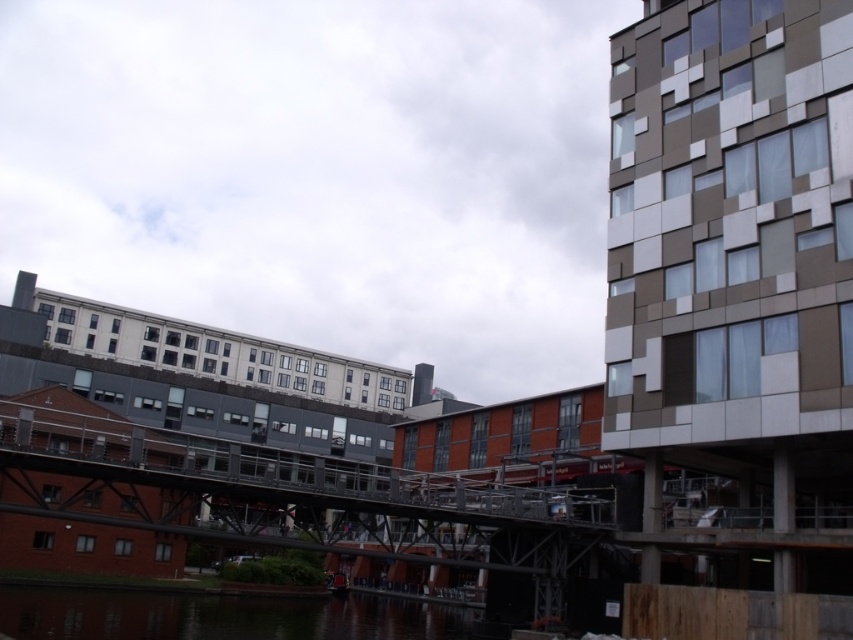
Based on the photo, can you confirm if metallic gray bridge at center is taller than smooth reflective water at lower center?

Yes.

Is metallic gray bridge at center wider than smooth reflective water at lower center?

Correct, the width of metallic gray bridge at center exceeds that of smooth reflective water at lower center.

What do you see at coordinates (283, 497) in the screenshot? Image resolution: width=853 pixels, height=640 pixels. I see `metallic gray bridge at center` at bounding box center [283, 497].

Where is `metallic gray bridge at center`? metallic gray bridge at center is located at coordinates (283, 497).